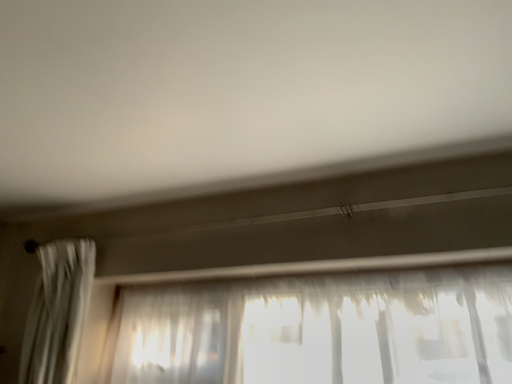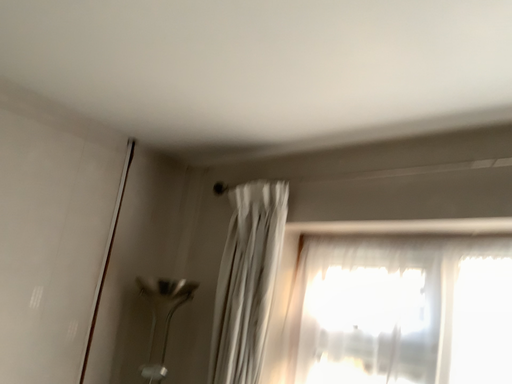
Question: Which way did the camera rotate in the video?

Choices:
 (A) rotated left
 (B) rotated right

Answer: (A)